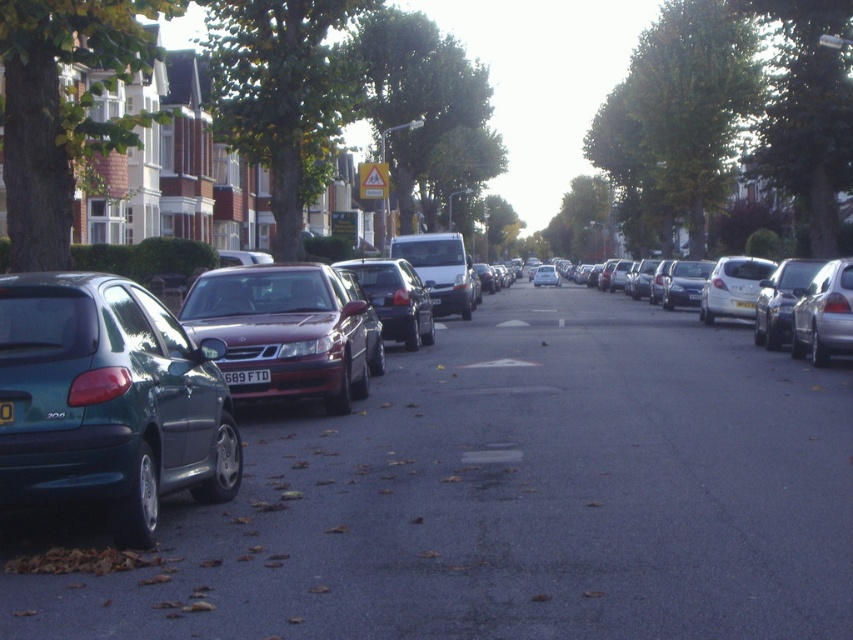
Can you confirm if shiny silver sedan at right is positioned to the left of white plastic license plate at center?

Indeed, shiny silver sedan at right is positioned on the left side of white plastic license plate at center.

Can you confirm if shiny silver sedan at right is positioned below white plastic license plate at center?

Actually, shiny silver sedan at right is above white plastic license plate at center.

Is point (780, 301) in front of point (741, 300)?

Yes, it is.

Where is `shiny silver sedan at right`? The height and width of the screenshot is (640, 853). shiny silver sedan at right is located at coordinates (781, 300).

Does metallic silver sedan at right have a greater width compared to white plastic license plate at center?

Yes.

Who is taller, metallic silver sedan at right or white plastic license plate at center?

metallic silver sedan at right is taller.

Does point (840, 339) lie behind point (735, 301)?

No, it is in front of (735, 301).

In order to click on metallic silver sedan at right in this screenshot , I will do `click(824, 314)`.

Is point (402, 317) less distant than point (790, 278)?

Yes, it is.

Between point (360, 262) and point (758, 337), which one is positioned behind?

Point (758, 337)

Is point (403, 259) farther from viewer compared to point (801, 276)?

Yes.

Where is `shiny metallic sedan at center-left`? shiny metallic sedan at center-left is located at coordinates (395, 298).